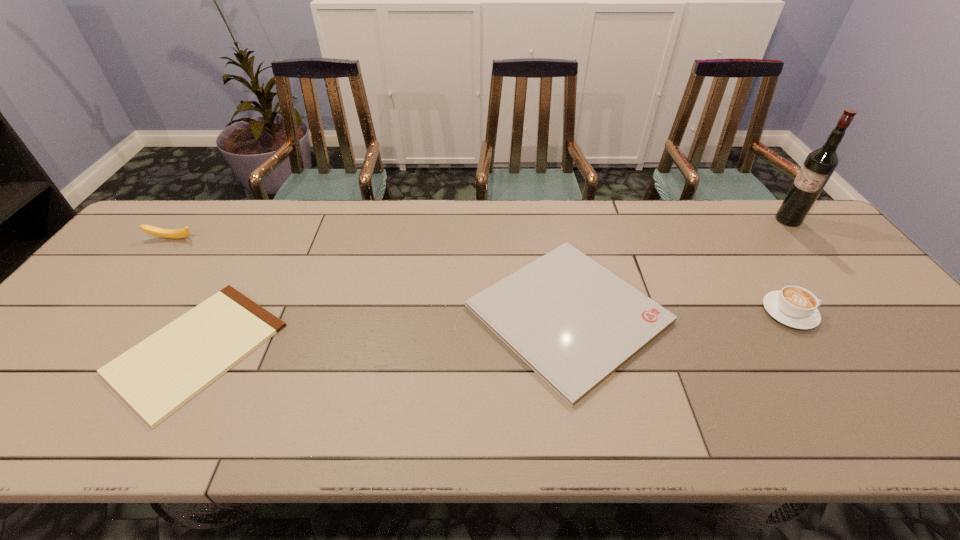
You are a GUI agent. You are given a task and a screenshot of the screen. Output one action in this format:
    pyautogui.click(x=<x>, y=<y>)
    Task: Click on the object situated at the far right corner
    
    Given the screenshot: What is the action you would take?
    (818, 167)

Locate an element on the screen. Image resolution: width=960 pixels, height=540 pixels. vacant space at the far edge of the desktop is located at coordinates (315, 221).

The height and width of the screenshot is (540, 960). What are the coordinates of `free space at the near edge of the desktop` in the screenshot? It's located at (524, 413).

The width and height of the screenshot is (960, 540). I want to click on free space at the left edge of the desktop, so click(64, 362).

In the image, there is a desktop. Identify the location of free space at the near left corner. (38, 407).

Locate an element on the screen. The height and width of the screenshot is (540, 960). vacant space at the far right corner of the desktop is located at coordinates (768, 207).

You are a GUI agent. You are given a task and a screenshot of the screen. Output one action in this format:
    pyautogui.click(x=<x>, y=<y>)
    Task: Click on the vacant area that lies between the rightmost object and the shortest object
    Image resolution: width=960 pixels, height=540 pixels.
    Given the screenshot: What is the action you would take?
    pyautogui.click(x=492, y=284)

Where is `empty space between the tallest object and the banana`? The height and width of the screenshot is (540, 960). empty space between the tallest object and the banana is located at coordinates (480, 230).

Find the location of a particular element. The width and height of the screenshot is (960, 540). vacant area between the second object from right to left and the taller clipboard is located at coordinates (679, 313).

Where is `vacant area between the fourth nearest object and the shorter clipboard`? vacant area between the fourth nearest object and the shorter clipboard is located at coordinates (185, 294).